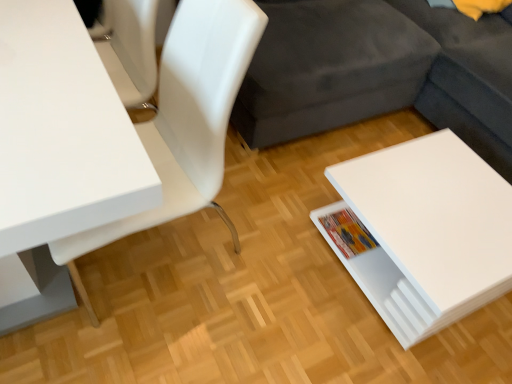
Find the location of a particular element. Image resolution: width=512 pixels, height=384 pixels. vacant space to the left of white glossy table at lower right, marked as the 2th table in a left-to-right arrangement is located at coordinates (279, 244).